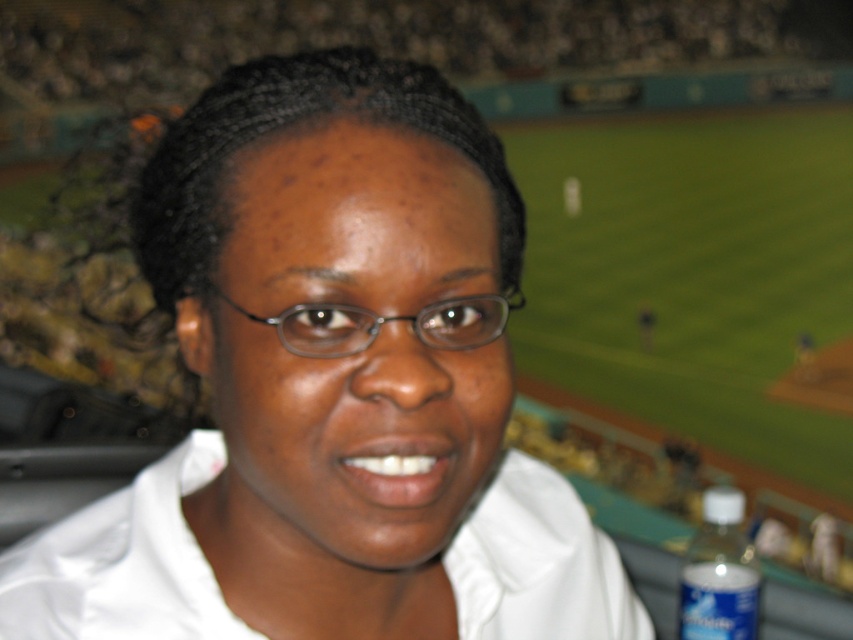
Question: Which point is closer to the camera?

Choices:
 (A) transparent plastic glasses at center
 (B) white cotton shirt at center
 (C) blue plastic bottle at lower right
 (D) white matte shirt at center

Answer: (D)

Question: Can you confirm if white cotton shirt at center is positioned above blue plastic bottle at lower right?

Choices:
 (A) no
 (B) yes

Answer: (B)

Question: Which of the following is the closest to the observer?

Choices:
 (A) white matte shirt at center
 (B) white cotton shirt at center

Answer: (A)

Question: Can you confirm if white matte shirt at center is wider than blue plastic bottle at lower right?

Choices:
 (A) no
 (B) yes

Answer: (B)

Question: Which object is farther from the camera taking this photo?

Choices:
 (A) white matte shirt at center
 (B) white cotton shirt at center
 (C) transparent plastic glasses at center

Answer: (B)

Question: Can you confirm if white matte shirt at center is bigger than transparent plastic glasses at center?

Choices:
 (A) yes
 (B) no

Answer: (A)